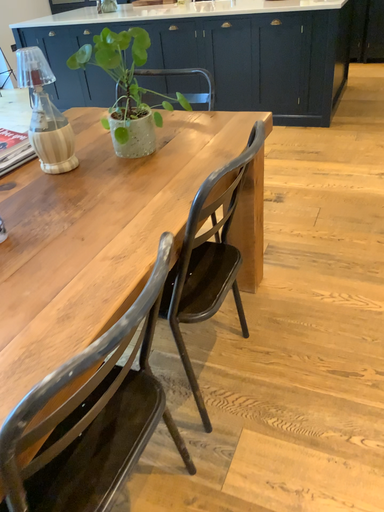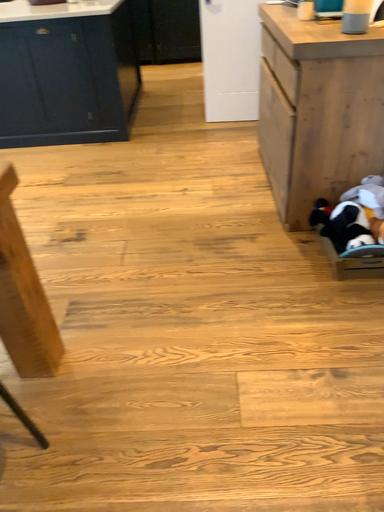
Question: How did the camera likely rotate when shooting the video?

Choices:
 (A) rotated left
 (B) rotated right

Answer: (B)